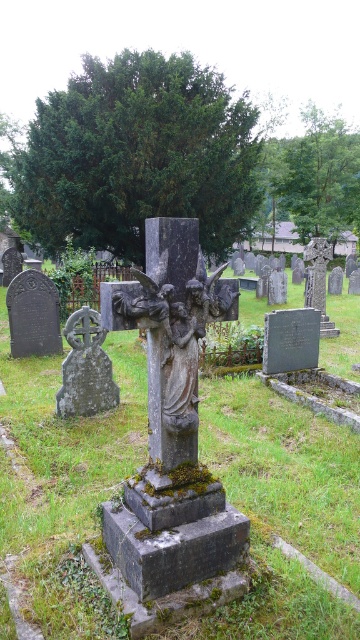
Question: In this image, where is gray stone statue at center located relative to gray stone cross at lower left?

Choices:
 (A) left
 (B) right

Answer: (B)

Question: Which point is farther from the camera taking this photo?

Choices:
 (A) (186, 451)
 (B) (74, 344)

Answer: (B)

Question: Does gray stone statue at center have a greater width compared to gray stone cross at lower left?

Choices:
 (A) yes
 (B) no

Answer: (A)

Question: Does gray stone statue at center have a lesser width compared to gray stone cross at lower left?

Choices:
 (A) yes
 (B) no

Answer: (B)